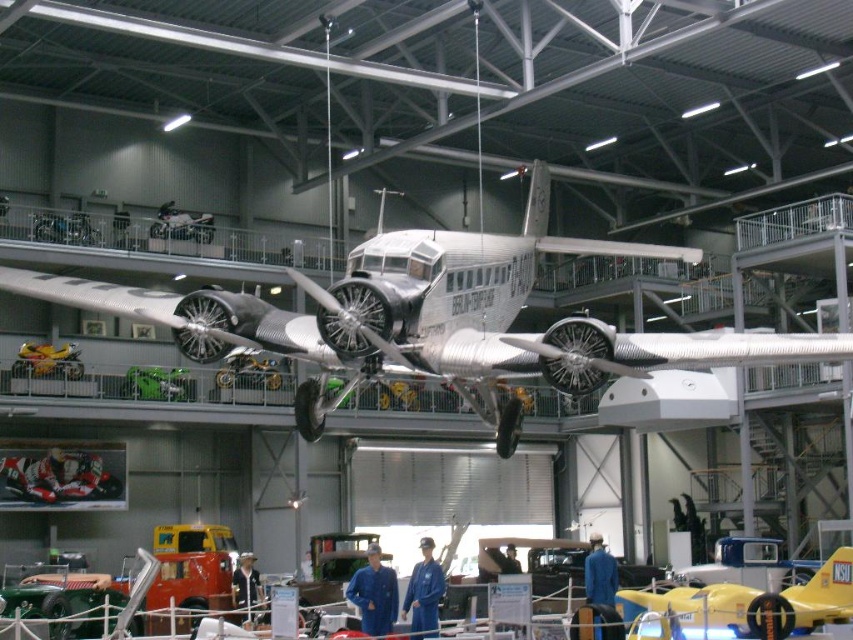
Does polished aluminum airplane at center have a greater width compared to yellow glossy airplane at center?

Yes, polished aluminum airplane at center is wider than yellow glossy airplane at center.

Which is behind, point (312, 380) or point (648, 612)?

The point (648, 612) is more distant.

In the scene shown: Who is more distant from viewer, (x=431, y=244) or (x=786, y=598)?

The point (x=786, y=598) is more distant.

You are a GUI agent. You are given a task and a screenshot of the screen. Output one action in this format:
    pyautogui.click(x=<x>, y=<y>)
    Task: Click on the polished aluminum airplane at center
    The height and width of the screenshot is (640, 853).
    Given the screenshot: What is the action you would take?
    pyautogui.click(x=433, y=321)